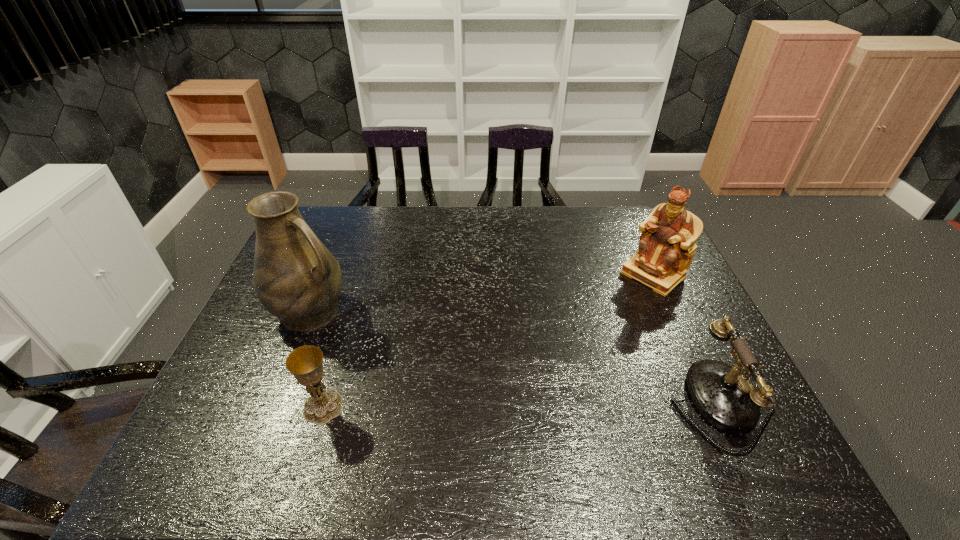
I want to click on vacant space located on the handle side of the tallest object, so click(357, 335).

You are a GUI agent. You are given a task and a screenshot of the screen. Output one action in this format:
    pyautogui.click(x=<x>, y=<y>)
    Task: Click on the chalice at the near edge
    Image resolution: width=960 pixels, height=540 pixels.
    Given the screenshot: What is the action you would take?
    pyautogui.click(x=305, y=363)

Where is `telephone at the near edge`? The height and width of the screenshot is (540, 960). telephone at the near edge is located at coordinates (726, 399).

Locate an element on the screen. object situated at the left edge is located at coordinates (296, 278).

I want to click on telephone present at the right edge, so click(x=726, y=399).

Find the location of a particular element. The width and height of the screenshot is (960, 540). figurine at the right edge is located at coordinates (666, 248).

The width and height of the screenshot is (960, 540). I want to click on object at the near right corner, so click(x=726, y=399).

Image resolution: width=960 pixels, height=540 pixels. In order to click on blank space at the far edge of the desktop in this screenshot , I will do (x=365, y=227).

At what (x,y) coordinates should I click in order to perform the action: click on free space at the near edge. Please return your answer as a coordinate pair (x, y). The image size is (960, 540). Looking at the image, I should click on (515, 399).

Find the location of `vacant space at the left edge`. vacant space at the left edge is located at coordinates (254, 390).